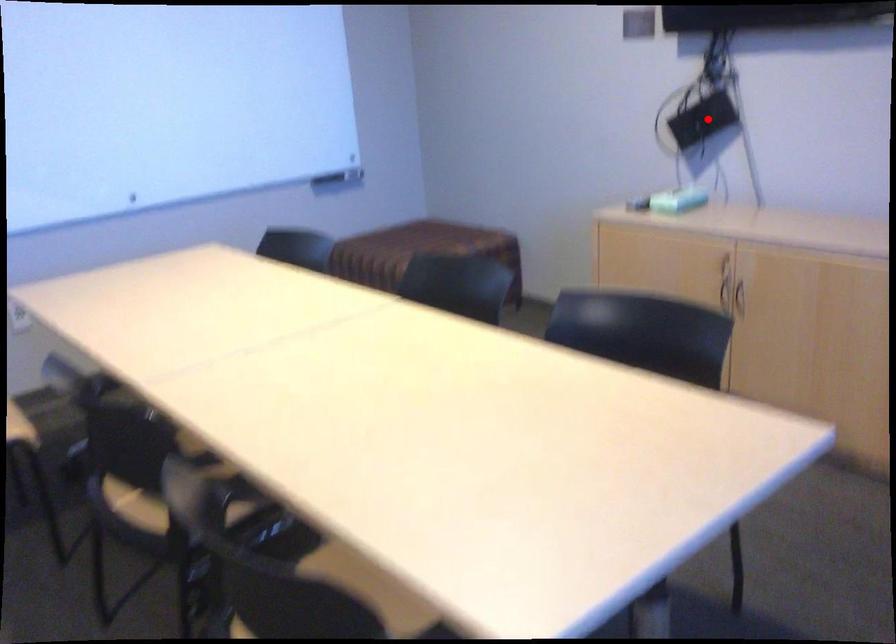
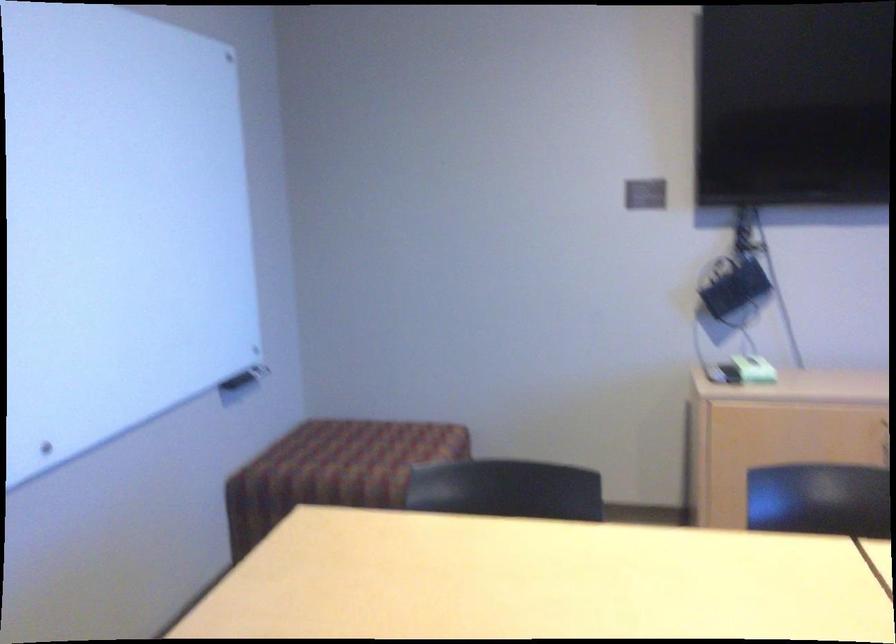
Where in the second image is the point corresponding to the highlighted location from the first image?

(734, 289)